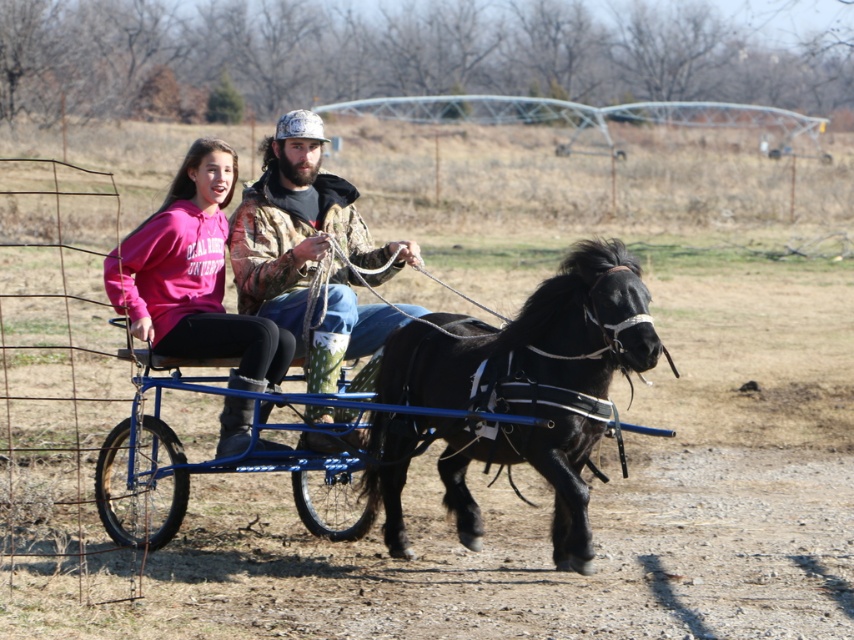
You are standing in the field and want to pick up the pink fleece sweatshirt at center and the blue metallic cart at center. Which object can you reach first without moving your feet?

The pink fleece sweatshirt at center is closer to you than the blue metallic cart at center, so you can reach it first without moving your feet.

You are standing at the origin point in the image. There is a point marked at coordinates (x=515, y=394). What object is this point located on?

The point at coordinates (x=515, y=394) is located on the black glossy horse at center.

You are a photographer trying to capture the two riders in the wagon. You notice the camouflage fabric shirt at center and the pink fleece sweatshirt at center. Which clothing item is positioned lower on the person?

The camouflage fabric shirt at center is below the pink fleece sweatshirt at center, so the camouflage fabric shirt at center is positioned lower.